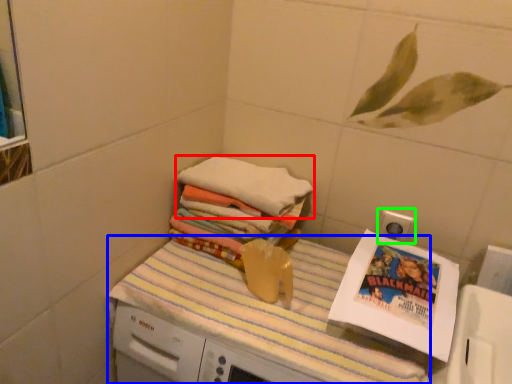
Question: Which is nearer to the towel (highlighted by a red box)? tablecloth (highlighted by a blue box) or electric outlet (highlighted by a green box).

Choices:
 (A) tablecloth
 (B) electric outlet

Answer: (A)